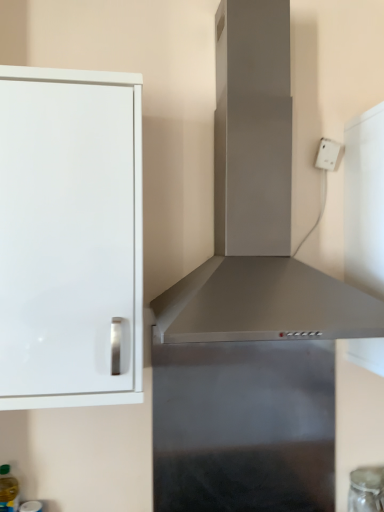
In order to face satin silver vent at center, should I rotate leftwards or rightwards?

Turn right by 10.727 degrees to look at satin silver vent at center.

Describe the element at coordinates (366, 489) in the screenshot. The width and height of the screenshot is (384, 512). I see `transparent glass jar at lower right` at that location.

The image size is (384, 512). Describe the element at coordinates (70, 237) in the screenshot. I see `white glossy cabinet at left` at that location.

This screenshot has height=512, width=384. In order to click on white glossy cabinet at left in this screenshot , I will do `click(70, 237)`.

Where is `satin silver vent at center`? The width and height of the screenshot is (384, 512). satin silver vent at center is located at coordinates (261, 304).

Considering the relative positions of white glossy cabinet at left and transparent glass jar at lower right in the image provided, is white glossy cabinet at left to the right of transparent glass jar at lower right from the viewer's perspective?

No.

Could you tell me if white glossy cabinet at left is turned towards transparent glass jar at lower right?

No, white glossy cabinet at left is not facing towards transparent glass jar at lower right.

Does white glossy cabinet at left have a smaller size compared to transparent glass jar at lower right?

Incorrect, white glossy cabinet at left is not smaller in size than transparent glass jar at lower right.

Identify the location of bottle behind the satin silver vent at center. The width and height of the screenshot is (384, 512). (8, 490).

Considering the relative sizes of satin silver vent at center and translucent plastic bottle at lower left in the image provided, is satin silver vent at center smaller than translucent plastic bottle at lower left?

No, satin silver vent at center is not smaller than translucent plastic bottle at lower left.

How different are the orientations of satin silver vent at center and translucent plastic bottle at lower left in degrees?

The angle between the facing direction of satin silver vent at center and the facing direction of translucent plastic bottle at lower left is 4.6 degrees.

Which object is positioned more to the right, satin silver vent at center or translucent plastic bottle at lower left?

From the viewer's perspective, satin silver vent at center appears more on the right side.

Based on the photo, from the image's perspective, would you say white glossy cabinet at left is positioned over translucent plastic bottle at lower left?

Correct, white glossy cabinet at left appears higher than translucent plastic bottle at lower left in the image.

Measure the distance between white glossy cabinet at left and translucent plastic bottle at lower left.

They are 29.40 inches apart.

Relative to translucent plastic bottle at lower left, is white glossy cabinet at left in front or behind?

Visually, white glossy cabinet at left is located in front of translucent plastic bottle at lower left.

Is point (53, 153) farther from camera compared to point (5, 492)?

No, (53, 153) is in front of (5, 492).

Looking at this image, from a real-world perspective, which object stands above the other?

satin silver vent at center.

Between transparent glass jar at lower right and satin silver vent at center, which one appears on the left side from the viewer's perspective?

satin silver vent at center is more to the left.

Which is in front, transparent glass jar at lower right or satin silver vent at center?

satin silver vent at center is in front.

From a real-world perspective, relative to translucent plastic bottle at lower left, is transparent glass jar at lower right vertically above or below?

transparent glass jar at lower right is below translucent plastic bottle at lower left.

Which point is more forward, [383,511] or [8,474]?

The point [8,474] is in front.

Based on the photo, which of these two, transparent glass jar at lower right or translucent plastic bottle at lower left, is smaller?

translucent plastic bottle at lower left is smaller.

Is satin silver vent at center placed right next to white glossy cabinet at left?

No, satin silver vent at center is not beside white glossy cabinet at left.

Can you confirm if satin silver vent at center is taller than white glossy cabinet at left?

Indeed, satin silver vent at center has a greater height compared to white glossy cabinet at left.

From the image's perspective, which one is positioned lower, satin silver vent at center or white glossy cabinet at left?

white glossy cabinet at left is shown below in the image.

Where is `appliance that is on the right side of translucent plastic bottle at lower left`? appliance that is on the right side of translucent plastic bottle at lower left is located at coordinates (366, 489).

Is translucent plastic bottle at lower left spatially inside transparent glass jar at lower right, or outside of it?

translucent plastic bottle at lower left is not enclosed by transparent glass jar at lower right.

From the picture: From the image's perspective, which is above, translucent plastic bottle at lower left or transparent glass jar at lower right?

translucent plastic bottle at lower left.

Is translucent plastic bottle at lower left positioned with its back to transparent glass jar at lower right?

No, translucent plastic bottle at lower left is not facing away from transparent glass jar at lower right.

Identify the location of appliance below the white glossy cabinet at left (from the image's perspective). The height and width of the screenshot is (512, 384). (366, 489).

At what (x,y) coordinates should I click in order to perform the action: click on bottle on the left side of satin silver vent at center. Please return your answer as a coordinate pair (x, y). The width and height of the screenshot is (384, 512). Looking at the image, I should click on (8, 490).

Which object lies further to the anchor point satin silver vent at center, translucent plastic bottle at lower left or white glossy cabinet at left?

translucent plastic bottle at lower left lies further to satin silver vent at center than the other object.

Estimate the real-world distances between objects in this image. Which object is closer to translucent plastic bottle at lower left, satin silver vent at center or transparent glass jar at lower right?

The object closer to translucent plastic bottle at lower left is transparent glass jar at lower right.

From the picture: From the image, which object appears to be farther from satin silver vent at center, white glossy cabinet at left or transparent glass jar at lower right?

Based on the image, transparent glass jar at lower right appears to be further to satin silver vent at center.

Looking at this image, based on their spatial positions, is white glossy cabinet at left or transparent glass jar at lower right further from translucent plastic bottle at lower left?

transparent glass jar at lower right is further to translucent plastic bottle at lower left.

Looking at the image, which one is located closer to transparent glass jar at lower right, translucent plastic bottle at lower left or white glossy cabinet at left?

translucent plastic bottle at lower left.

When comparing their distances from satin silver vent at center, does transparent glass jar at lower right or white glossy cabinet at left seem further?

transparent glass jar at lower right.

Looking at the image, which one is located closer to white glossy cabinet at left, satin silver vent at center or translucent plastic bottle at lower left?

satin silver vent at center.

From the image, which object appears to be farther from satin silver vent at center, translucent plastic bottle at lower left or transparent glass jar at lower right?

translucent plastic bottle at lower left is positioned further to the anchor satin silver vent at center.

Identify the location of cabinetry between satin silver vent at center and transparent glass jar at lower right in the up-down direction. The height and width of the screenshot is (512, 384). (70, 237).

Image resolution: width=384 pixels, height=512 pixels. In order to click on cabinetry between translucent plastic bottle at lower left and transparent glass jar at lower right from left to right in this screenshot , I will do [70, 237].

Image resolution: width=384 pixels, height=512 pixels. In order to click on bottle between satin silver vent at center and transparent glass jar at lower right in the up-down direction in this screenshot , I will do click(x=8, y=490).

Locate an element on the screen. cabinetry between satin silver vent at center and translucent plastic bottle at lower left from top to bottom is located at coordinates (70, 237).